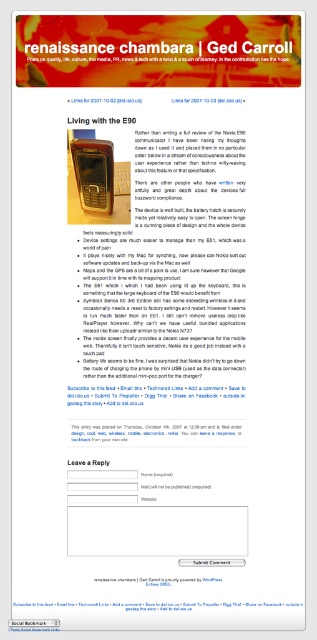
Who is shorter, white paper at center or brown leather wallet at upper center?

brown leather wallet at upper center is shorter.

How much distance is there between white paper at center and brown leather wallet at upper center?

white paper at center and brown leather wallet at upper center are 30.30 inches apart.

Is point (194, 580) positioned after point (75, 122)?

No.

At what (x,y) coordinates should I click in order to perform the action: click on white paper at center. Please return your answer as a coordinate pair (x, y). Looking at the image, I should click on (156, 579).

Is point (47, 604) closer to viewer compared to point (156, 579)?

That is True.

Does white paper at upper center appear under white paper at center?

Indeed, white paper at upper center is positioned under white paper at center.

Locate an element on the screen. Image resolution: width=317 pixels, height=640 pixels. white paper at upper center is located at coordinates (157, 604).

Find the location of a particular element. white paper at upper center is located at coordinates (157, 604).

Is white paper at upper center bigger than brown leather wallet at upper center?

Indeed, white paper at upper center has a larger size compared to brown leather wallet at upper center.

Where is `white paper at upper center`? This screenshot has height=640, width=317. white paper at upper center is located at coordinates (157, 604).

This screenshot has height=640, width=317. Identify the location of white paper at upper center. (157, 604).